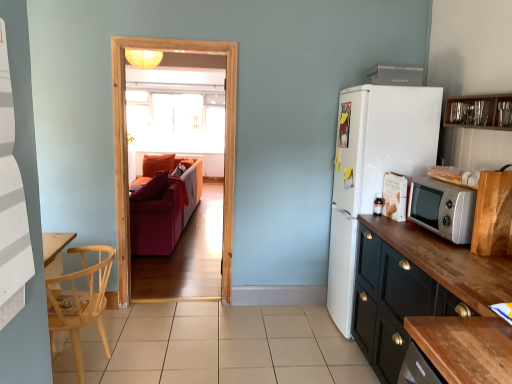
Question: Considering the relative positions of clear glass window at center and silver metallic microwave oven at right in the image provided, is clear glass window at center in front of silver metallic microwave oven at right?

Choices:
 (A) no
 (B) yes

Answer: (A)

Question: Does clear glass window at center appear on the right side of silver metallic microwave oven at right?

Choices:
 (A) no
 (B) yes

Answer: (A)

Question: Is clear glass window at center turned away from silver metallic microwave oven at right?

Choices:
 (A) yes
 (B) no

Answer: (B)

Question: Is clear glass window at center outside silver metallic microwave oven at right?

Choices:
 (A) no
 (B) yes

Answer: (B)

Question: Can you confirm if clear glass window at center is taller than silver metallic microwave oven at right?

Choices:
 (A) yes
 (B) no

Answer: (A)

Question: From the image's perspective, is black wood cabinet at right, which is the third cabinetry from top to bottom, above or below beige tile at center?

Choices:
 (A) below
 (B) above

Answer: (B)

Question: Is point (368, 322) positioned closer to the camera than point (206, 370)?

Choices:
 (A) farther
 (B) closer

Answer: (A)

Question: Is black wood cabinet at right, which is the third cabinetry from top to bottom, to the left or to the right of beige tile at center in the image?

Choices:
 (A) right
 (B) left

Answer: (A)

Question: From a real-world perspective, is black wood cabinet at right, which appears as the first cabinetry when ordered from the bottom, above or below beige tile at center?

Choices:
 (A) above
 (B) below

Answer: (A)

Question: Considering the positions of wooden cabinet at right, arranged as the second cabinetry when ordered from the bottom, and white plastic microwave at upper right in the image, is wooden cabinet at right, arranged as the second cabinetry when ordered from the bottom, wider or thinner than white plastic microwave at upper right?

Choices:
 (A) thin
 (B) wide

Answer: (A)

Question: In the image, is wooden cabinet at right, arranged as the second cabinetry when ordered from the bottom, positioned in front of or behind white plastic microwave at upper right?

Choices:
 (A) behind
 (B) front

Answer: (B)

Question: Choose the correct answer: Is wooden cabinet at right, which ranks as the 2th cabinetry in top-to-bottom order, inside white plastic microwave at upper right or outside it?

Choices:
 (A) outside
 (B) inside

Answer: (A)

Question: Considering the positions of wooden cabinet at right, arranged as the second cabinetry when ordered from the bottom, and white plastic microwave at upper right in the image, is wooden cabinet at right, arranged as the second cabinetry when ordered from the bottom, bigger or smaller than white plastic microwave at upper right?

Choices:
 (A) small
 (B) big

Answer: (A)

Question: Do you think natural wood chair at left is within transparent glass door at center, or outside of it?

Choices:
 (A) outside
 (B) inside

Answer: (A)

Question: From a real-world perspective, is natural wood chair at left physically located above or below transparent glass door at center?

Choices:
 (A) below
 (B) above

Answer: (A)